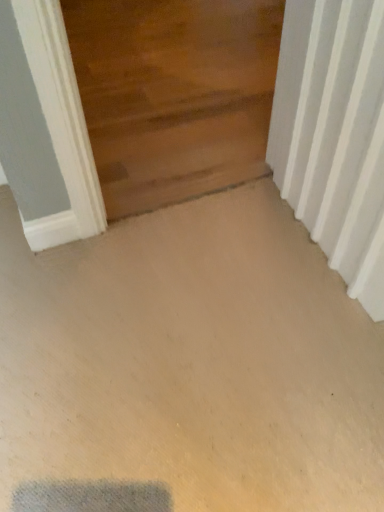
Question: Does point (261, 67) appear closer or farther from the camera than point (357, 56)?

Choices:
 (A) closer
 (B) farther

Answer: (B)

Question: From a real-world perspective, relative to white textured radiator at right, is wooden door at upper center vertically above or below?

Choices:
 (A) below
 (B) above

Answer: (A)

Question: Considering their positions, is wooden door at upper center located in front of or behind white textured radiator at right?

Choices:
 (A) front
 (B) behind

Answer: (B)

Question: In terms of width, does white textured radiator at right look wider or thinner when compared to wooden door at upper center?

Choices:
 (A) wide
 (B) thin

Answer: (B)

Question: Looking at the image, does white textured radiator at right seem bigger or smaller compared to wooden door at upper center?

Choices:
 (A) big
 (B) small

Answer: (B)

Question: Considering their positions, is white textured radiator at right located in front of or behind wooden door at upper center?

Choices:
 (A) front
 (B) behind

Answer: (A)

Question: Is point coord(321,244) positioned closer to the camera than point coord(236,27)?

Choices:
 (A) closer
 (B) farther

Answer: (A)